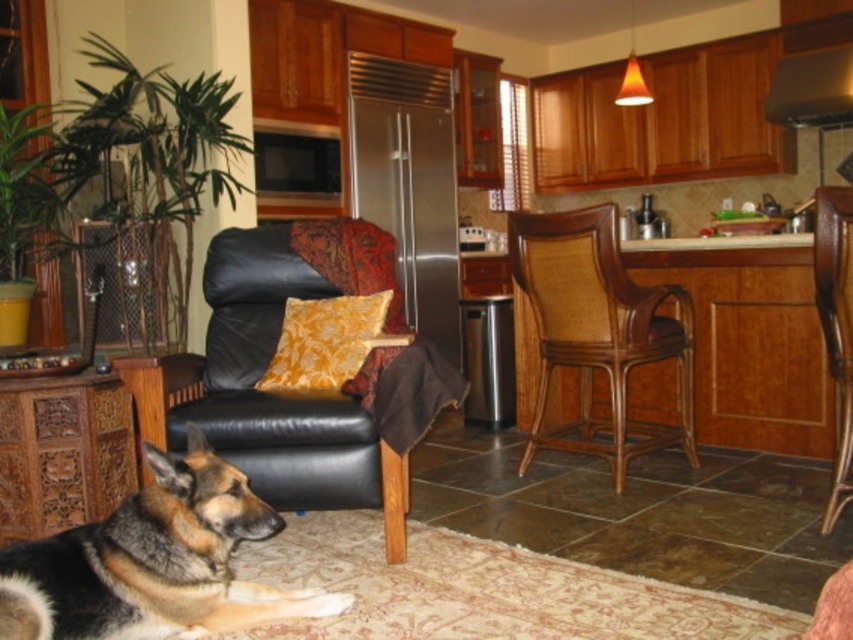
You are sitting in the brown woven wood chair at center and want to reach the yellow floral pillow at center to adjust its position. Based on their arrangement, can you easily reach the pillow without moving the chair?

The brown woven wood chair at center is positioned under yellow floral pillow at center, so the pillow is likely above the chair. This means you can easily reach it by simply stretching your hand upwards from the brown woven wood chair at center.

You are a guest in this home and want to sit in the brown woven wood chair at center. However, you notice the stainless steel exhaust hood at upper right. Is there a risk that the exhaust hood could interfere with your ability to sit comfortably in the chair?

The brown woven wood chair at center is positioned under the stainless steel exhaust hood at upper right, so there is a risk that the exhaust hood could interfere with sitting comfortably in the chair.